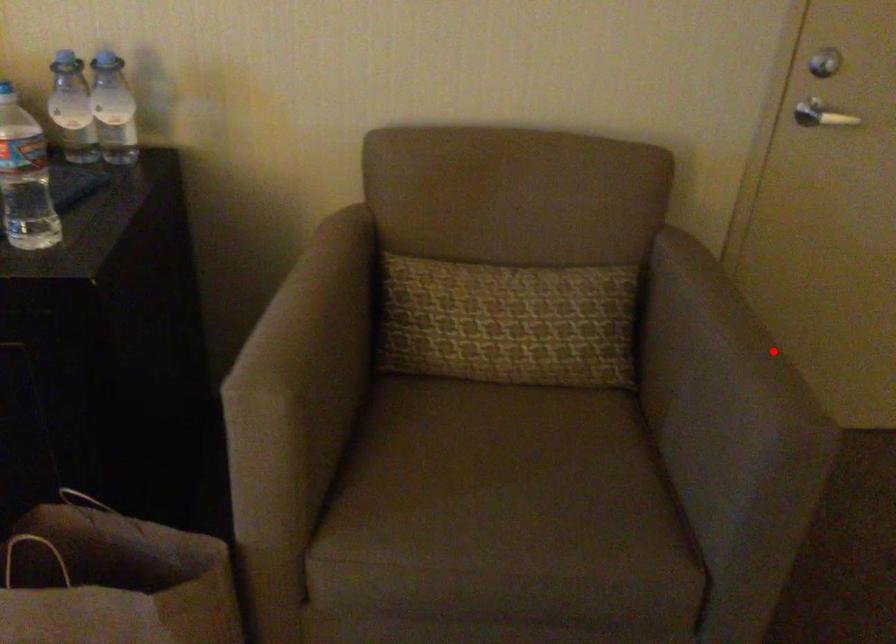
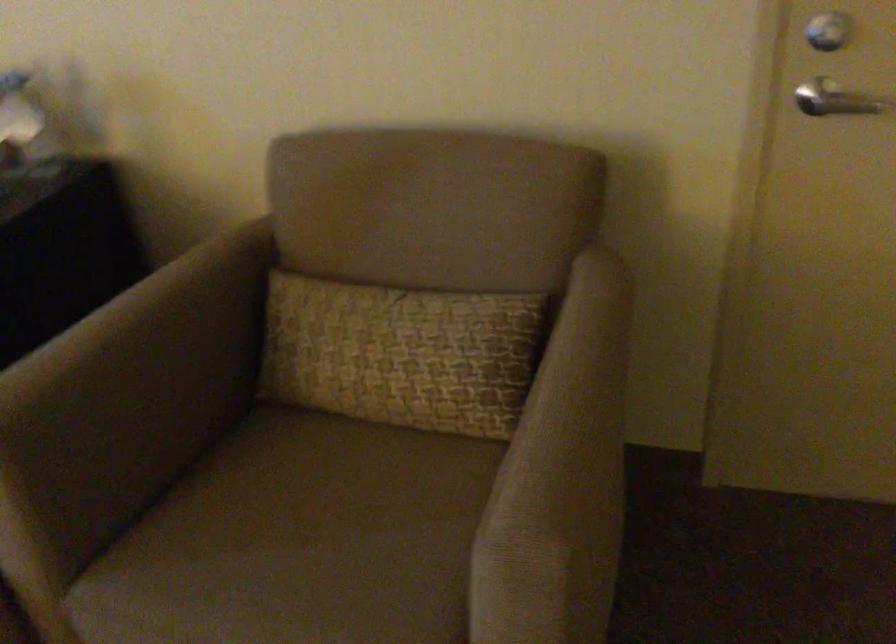
Locate, in the second image, the point that corresponds to the highlighted location in the first image.

(581, 424)